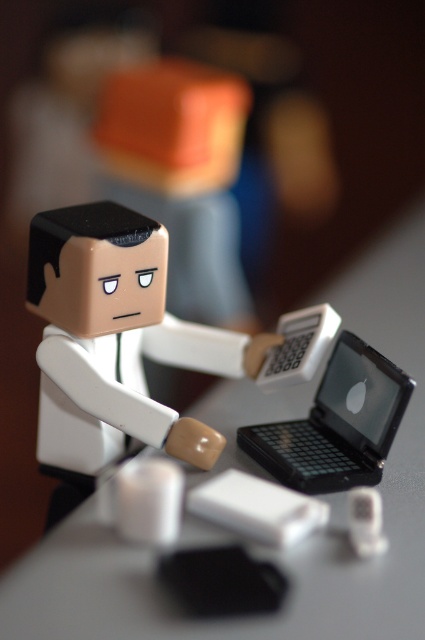
Question: Can you confirm if white matte figure at center is bigger than black plastic laptop at center?

Choices:
 (A) yes
 (B) no

Answer: (A)

Question: Can you confirm if white matte figure at center is positioned below black plastic laptop at center?

Choices:
 (A) yes
 (B) no

Answer: (B)

Question: Is white matte figure at center to the left of black plastic laptop at center from the viewer's perspective?

Choices:
 (A) no
 (B) yes

Answer: (B)